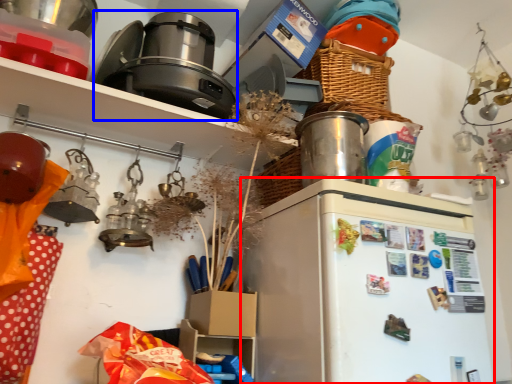
Question: Which of the following is the farthest to the observer, fridge (highlighted by a red box) or appliance (highlighted by a blue box)?

Choices:
 (A) fridge
 (B) appliance

Answer: (B)